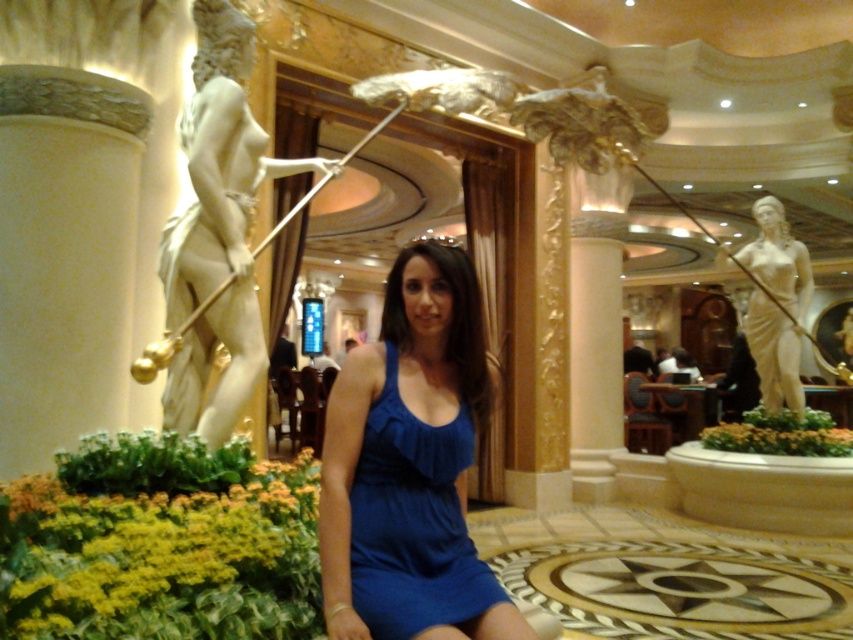
Does white marble statue at left have a smaller size compared to white marble statue at right?

Actually, white marble statue at left might be larger than white marble statue at right.

Who is more forward, (241,205) or (770,356)?

Point (241,205) is in front.

Does point (230, 148) lie in front of point (769, 410)?

Yes, point (230, 148) is in front of point (769, 410).

This screenshot has width=853, height=640. Find the location of `white marble statue at left`. white marble statue at left is located at coordinates (218, 230).

The width and height of the screenshot is (853, 640). What do you see at coordinates (218, 230) in the screenshot? I see `white marble statue at left` at bounding box center [218, 230].

Who is positioned more to the left, white marble statue at left or matte blue dress at center?

Positioned to the left is white marble statue at left.

Locate an element on the screen. The image size is (853, 640). white marble statue at left is located at coordinates pos(218,230).

From the picture: Is matte blue dress at center shorter than white marble statue at right?

Yes, matte blue dress at center is shorter than white marble statue at right.

Based on the photo, which of these two, matte blue dress at center or white marble statue at right, stands taller?

Standing taller between the two is white marble statue at right.

Measure the distance between point (392, 556) and camera.

Point (392, 556) is 6.21 feet away from camera.

The image size is (853, 640). I want to click on matte blue dress at center, so click(413, 522).